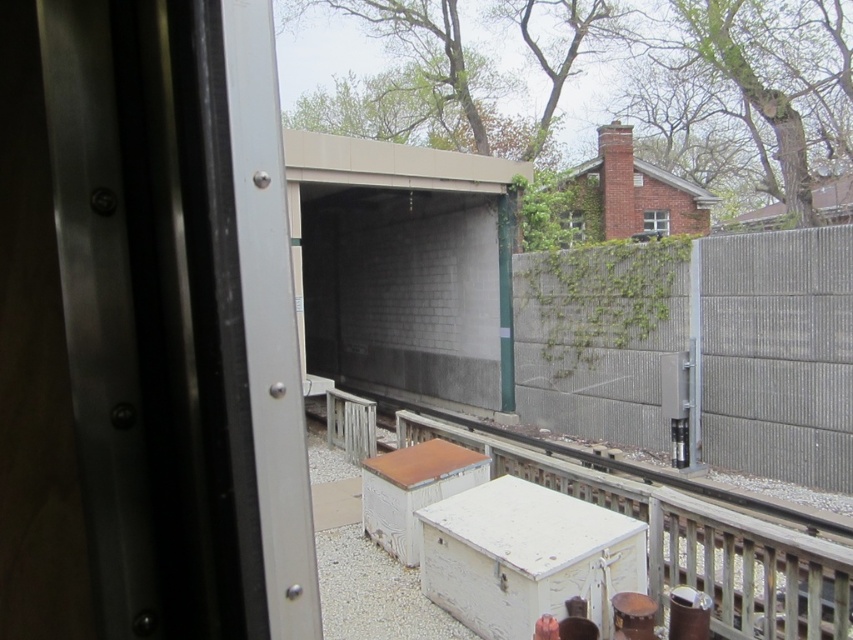
Question: Which point is farther to the camera?

Choices:
 (A) (653, 225)
 (B) (381, 356)
 (C) (741, 422)

Answer: (A)

Question: Estimate the real-world distances between objects in this image. Which object is closer to the matte glass screen door at center?

Choices:
 (A) clear glass window at upper right
 (B) white painted wood at center
 (C) matte brick window at upper center
 (D) gray concrete fence at right

Answer: (C)

Question: Which object appears farthest from the camera in this image?

Choices:
 (A) white painted wood at center
 (B) matte glass screen door at center

Answer: (B)

Question: Does matte glass screen door at center appear on the right side of matte brick window at upper center?

Choices:
 (A) yes
 (B) no

Answer: (B)

Question: Observing the image, what is the correct spatial positioning of matte glass screen door at center in reference to white painted wood at center?

Choices:
 (A) above
 (B) below

Answer: (A)

Question: Does matte glass screen door at center have a smaller size compared to white painted wood at center?

Choices:
 (A) yes
 (B) no

Answer: (B)